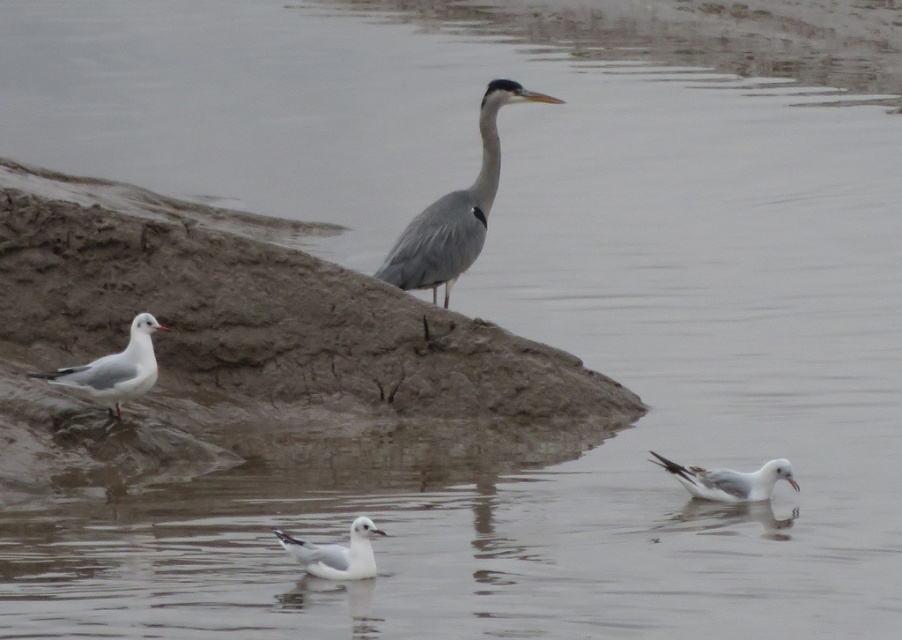
You are a birdwatcher standing at the edge of the muddy bank. You spot the gray matte heron at center and the white matte seagull at lower left. How far apart are these two birds from each other?

The gray matte heron at center is 4.56 feet away from the white matte seagull at lower left.

You are a birdwatcher observing the scene. You notice the gray matte heron at center and the white matte seagull at lower left. Which bird is taller?

The gray matte heron at center is taller than the white matte seagull at lower left.

You are standing at the shoreline and want to walk towards the two points marked in the image. Which point, point [425,269] or point [675,476], will you reach first?

You will reach point [425,269] first because it is closer to you than point [675,476], which is further away.